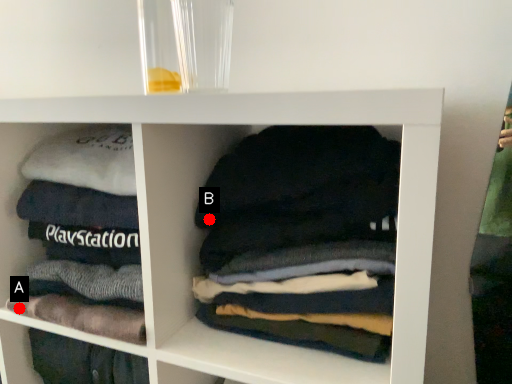
Question: Two points are circled on the image, labeled by A and B beside each circle. Which point appears closest to the camera in this image?

Choices:
 (A) A is closer
 (B) B is closer

Answer: (B)